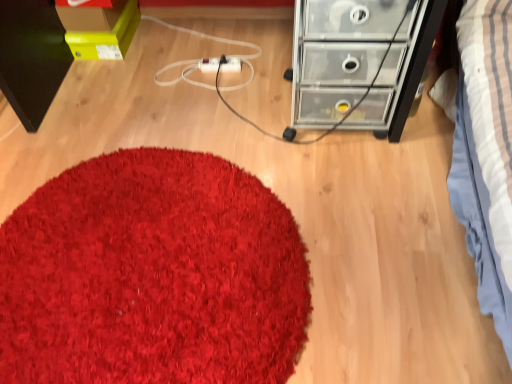
Where is `free space to the back side of white plastic extension cord at center`? free space to the back side of white plastic extension cord at center is located at coordinates (221, 46).